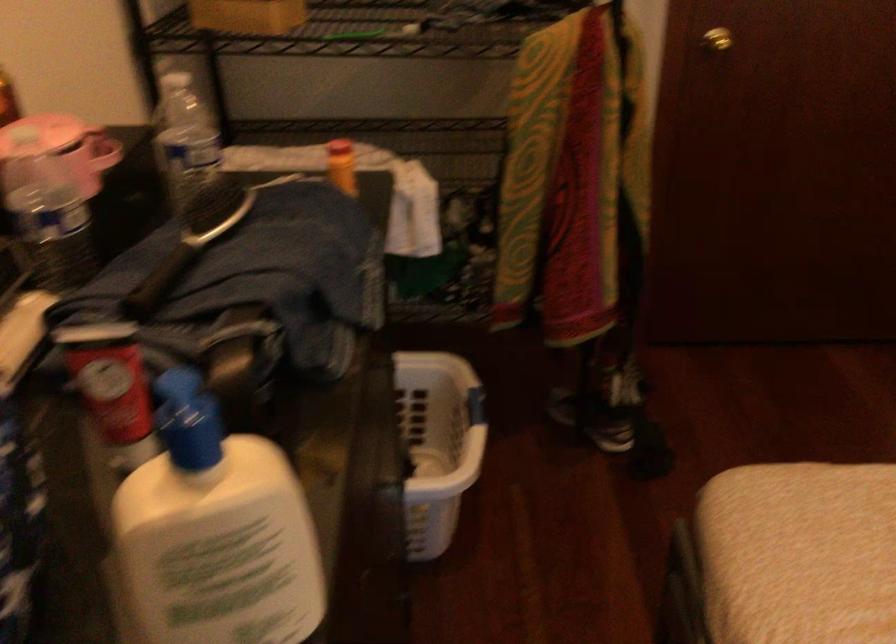
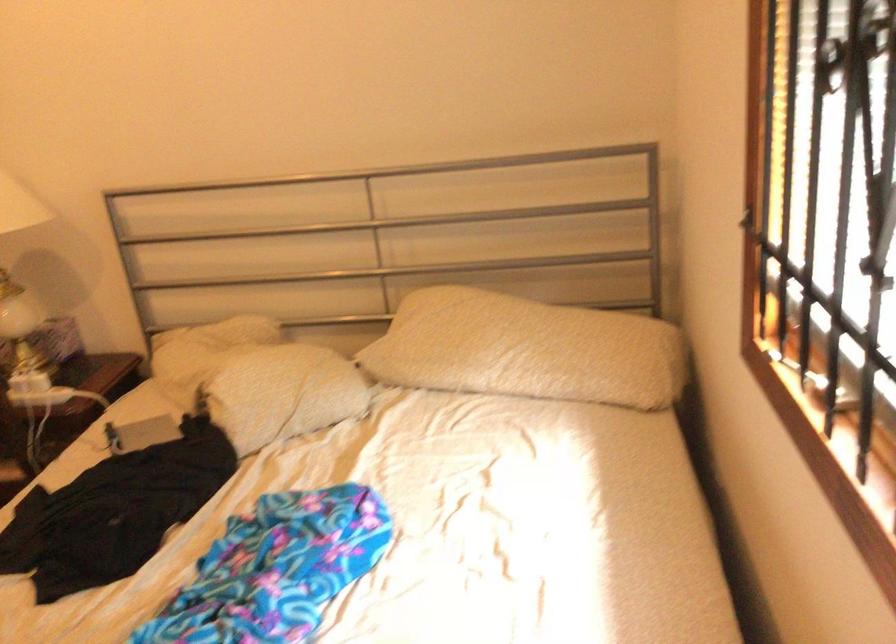
Question: The first image is from the beginning of the video and the second image is from the end. How did the camera likely rotate when shooting the video?

Choices:
 (A) Left
 (B) Right
 (C) Up
 (D) Down

Answer: (B)